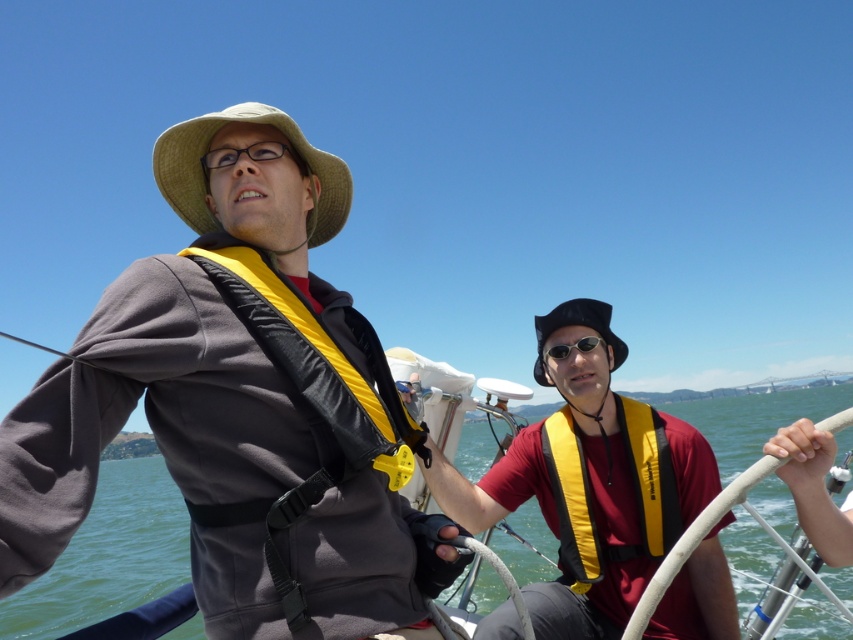
Question: Is matte yellow life vest at center bigger than matte black goggles at center?

Choices:
 (A) no
 (B) yes

Answer: (B)

Question: Is matte yellow life vest at center to the right of black straw hat at center from the viewer's perspective?

Choices:
 (A) yes
 (B) no

Answer: (B)

Question: Is matte yellow life vest at center above clear blue water at center?

Choices:
 (A) no
 (B) yes

Answer: (B)

Question: Which object is positioned farthest from the matte yellow life vest at right?

Choices:
 (A) matte black goggles at center
 (B) matte yellow life vest at center
 (C) matte black goggles at upper center

Answer: (C)

Question: Which point is closer to the camera taking this photo?

Choices:
 (A) (577, 305)
 (B) (200, 186)
 (C) (202, 156)

Answer: (C)

Question: Considering the real-world distances, which object is farthest from the matte yellow life vest at right?

Choices:
 (A) matte yellow life vest at center
 (B) straw hat at upper left
 (C) clear blue water at center
 (D) matte black goggles at center

Answer: (C)